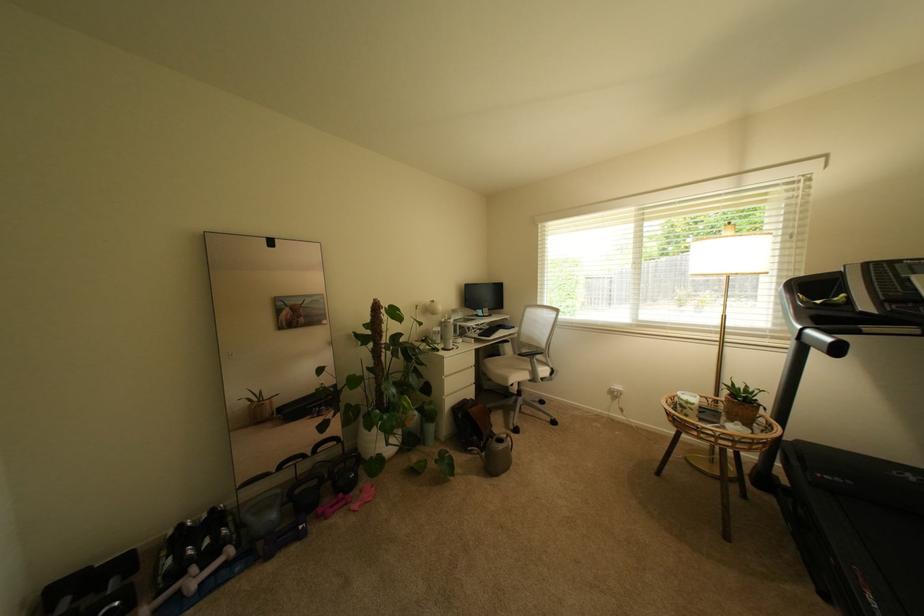
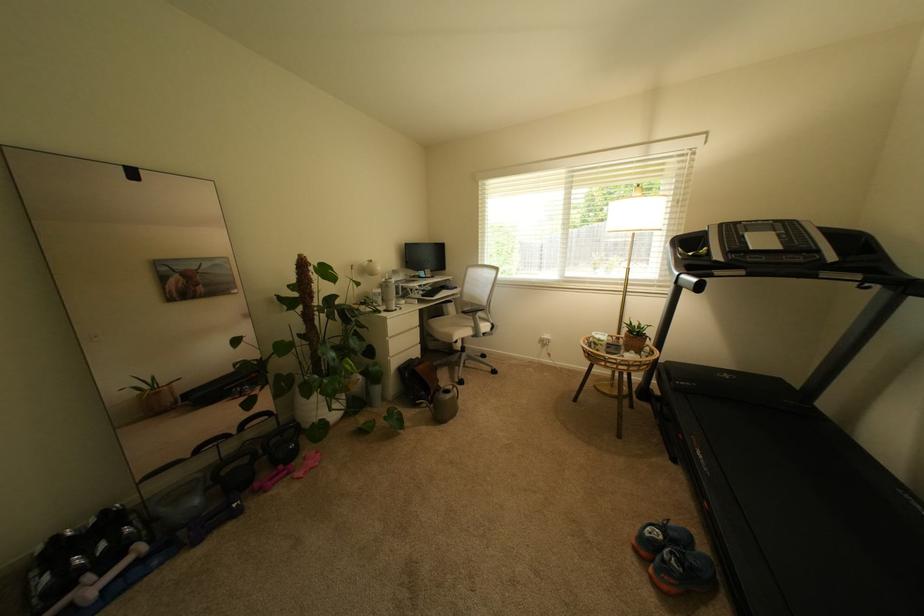
The point at (374, 432) is marked in the first image. Where is the corresponding point in the second image?

(312, 400)